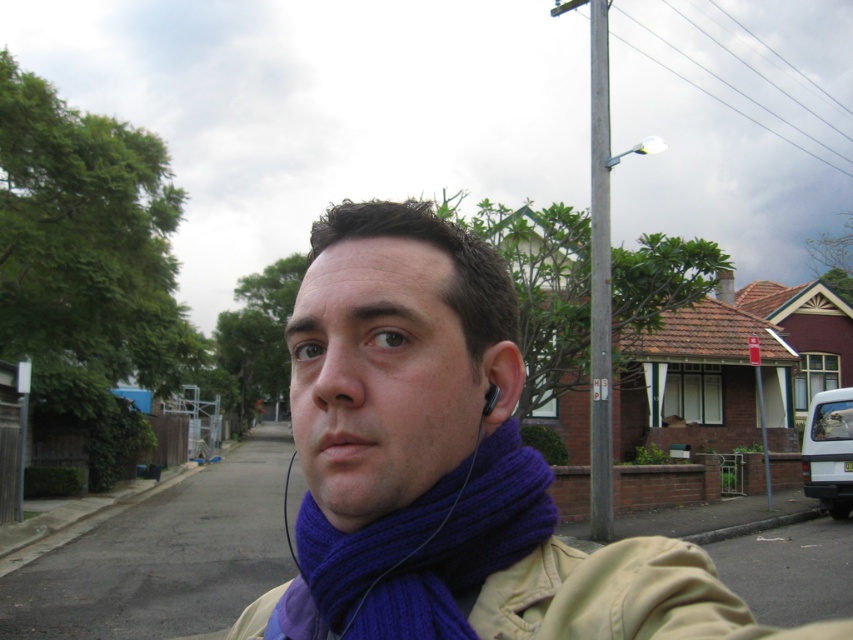
Who is lower down, purple knitted scarf at center or knitted purple scarf at center?

Positioned lower is purple knitted scarf at center.

Who is more distant from viewer, (428, 477) or (442, 618)?

Positioned behind is point (428, 477).

What are the coordinates of `purple knitted scarf at center` in the screenshot? It's located at coord(447,465).

Which is below, knitted purple scarf at center or black matte earphone at ear?

knitted purple scarf at center is lower down.

Find the location of a particular element. knitted purple scarf at center is located at coordinates (421, 550).

Between point (482, 573) and point (488, 394), which one is positioned behind?

Positioned behind is point (488, 394).

The width and height of the screenshot is (853, 640). I want to click on knitted purple scarf at center, so click(x=421, y=550).

Does purple knitted scarf at center come in front of gray metallic pole at upper center?

Yes, it is in front of gray metallic pole at upper center.

Which of these two, purple knitted scarf at center or gray metallic pole at upper center, stands taller?

gray metallic pole at upper center is taller.

What do you see at coordinates (447, 465) in the screenshot? This screenshot has height=640, width=853. I see `purple knitted scarf at center` at bounding box center [447, 465].

This screenshot has height=640, width=853. Find the location of `purple knitted scarf at center`. purple knitted scarf at center is located at coordinates (447, 465).